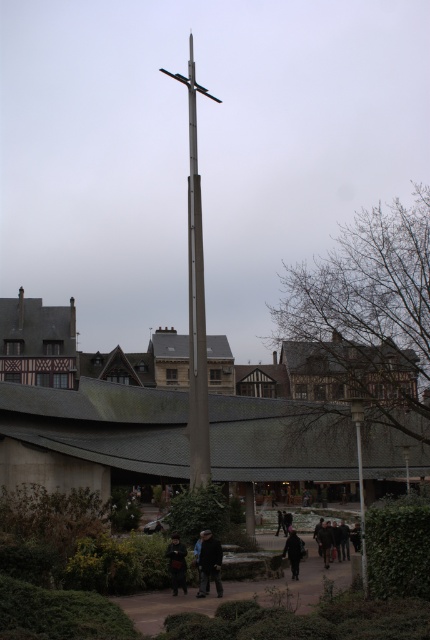
Can you confirm if dark gray jacket at lower center is wider than dark gray jacket at center?

Indeed, dark gray jacket at lower center has a greater width compared to dark gray jacket at center.

Between dark gray jacket at lower center and dark gray jacket at center, which one appears on the left side from the viewer's perspective?

From the viewer's perspective, dark gray jacket at center appears more on the left side.

Locate an element on the screen. The width and height of the screenshot is (430, 640). dark gray jacket at lower center is located at coordinates (331, 540).

Can you confirm if dark blue jeans at lower center is bigger than dark matte jacket at center?

No.

Can you confirm if dark blue jeans at lower center is wider than dark matte jacket at center?

No, dark blue jeans at lower center is not wider than dark matte jacket at center.

Is point (214, 540) less distant than point (297, 572)?

That is True.

Locate an element on the screen. The image size is (430, 640). dark blue jeans at lower center is located at coordinates (209, 563).

What do you see at coordinates (196, 298) in the screenshot? I see `metallic gray pole at center` at bounding box center [196, 298].

Is metallic gray pole at center thinner than dark gray jacket at center?

No.

Describe the element at coordinates (196, 298) in the screenshot. The height and width of the screenshot is (640, 430). I see `metallic gray pole at center` at that location.

Image resolution: width=430 pixels, height=640 pixels. Find the location of `metallic gray pole at center`. metallic gray pole at center is located at coordinates (196, 298).